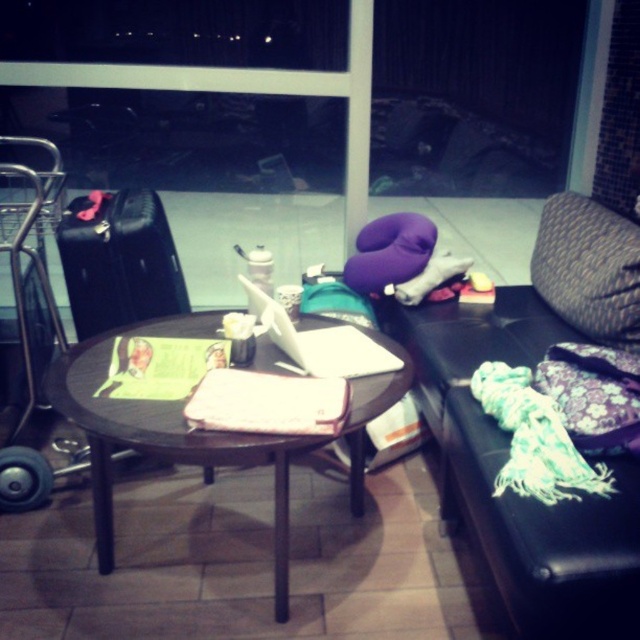
You are sitting on a chair in front of the wooden table at center and want to reach the black leather suitcase at left. Is the suitcase closer to you or farther away than the table?

The wooden table at center is closer to the viewer than the black leather suitcase at left, so the suitcase is farther away from you than the table.

You are standing in the lounge and need to place a teal fabric armchair at lower right. According to the scene description, where should you position it?

The teal fabric armchair at lower right should be positioned at point 0.680 on the x axis and 0.794 on the y axis as per the coordinates provided.